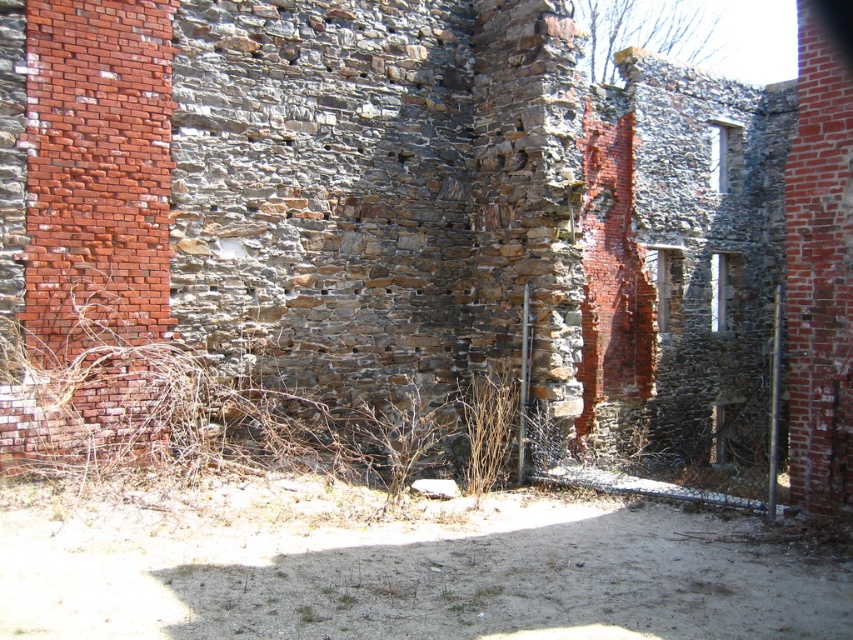
You are an archaeologist examining the ruins of an old building. You notice brown dry weed at center and brown dry grass at center growing in the same area. Which one is growing on top of the other?

The brown dry weed at center is positioned over the brown dry grass at center, meaning the weed is growing on top of the grass.

You are standing in front of the ruins of an old stone building. You notice two points marked in the scene. The first point is at coordinate (405,477) and the second is at (473,433). Which of these two points is closer to you?

Point (405,477) is closer to the viewer than point (473,433).

You are a botanist examining the ruins of an old stone building. You notice a point marked at coordinates (x=399, y=436). What type of vegetation is located at this point?

The point at (x=399, y=436) indicates brown dry weed at center.